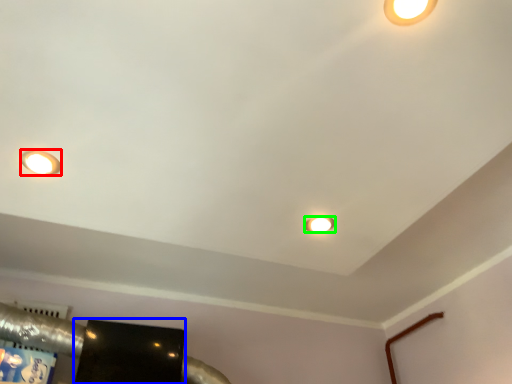
Question: Which is nearer to the lamp (highlighted by a red box)? wide (highlighted by a blue box) or lamp (highlighted by a green box).

Choices:
 (A) wide
 (B) lamp

Answer: (B)